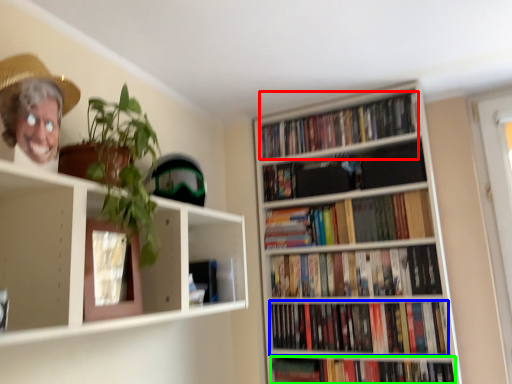
Question: Based on their relative distances, which object is farther from book (highlighted by a red box)? Choose from book (highlighted by a blue box) and book (highlighted by a green box).

Choices:
 (A) book
 (B) book

Answer: (B)